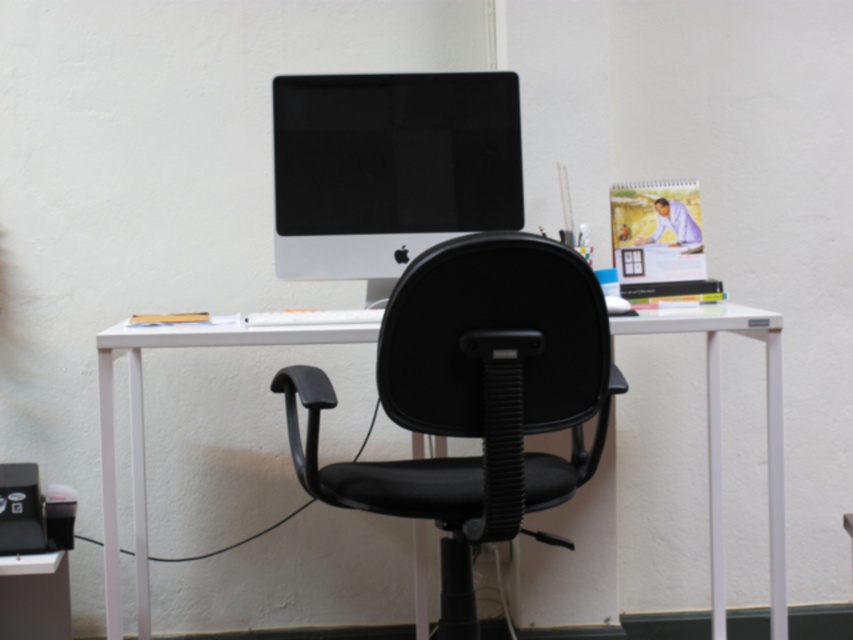
Who is shorter, black leather swivel chair at center or sleek silver monitor at center?

sleek silver monitor at center is shorter.

Does black leather swivel chair at center have a lesser height compared to sleek silver monitor at center?

No, black leather swivel chair at center is not shorter than sleek silver monitor at center.

Which is in front, point (590, 280) or point (442, 134)?

Point (590, 280)

In order to click on black leather swivel chair at center in this screenshot , I will do click(x=474, y=396).

Is sleek silver monitor at center positioned at the back of white plastic desk at center?

Yes, sleek silver monitor at center is further from the viewer.

Is point (380, 140) in front of point (729, 323)?

No, (380, 140) is behind (729, 323).

Image resolution: width=853 pixels, height=640 pixels. I want to click on sleek silver monitor at center, so click(x=389, y=168).

Who is taller, black leather swivel chair at center or white plastic desk at center?

black leather swivel chair at center

Is point (555, 484) positioned after point (142, 435)?

No, (555, 484) is in front of (142, 435).

Between point (509, 406) and point (97, 339), which one is positioned behind?

Point (97, 339)

Locate an element on the screen. The width and height of the screenshot is (853, 640). black leather swivel chair at center is located at coordinates (474, 396).